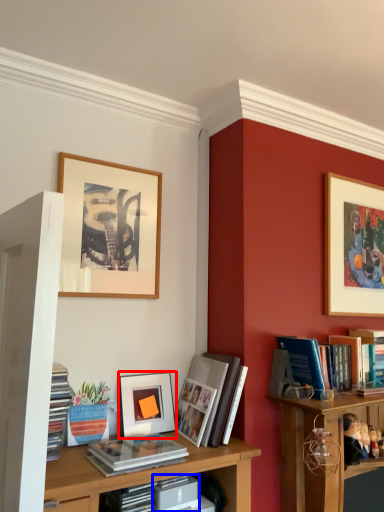
Question: Which of the following is the closest to the observer, picture frame (highlighted by a red box) or paperback book (highlighted by a blue box)?

Choices:
 (A) picture frame
 (B) paperback book

Answer: (B)